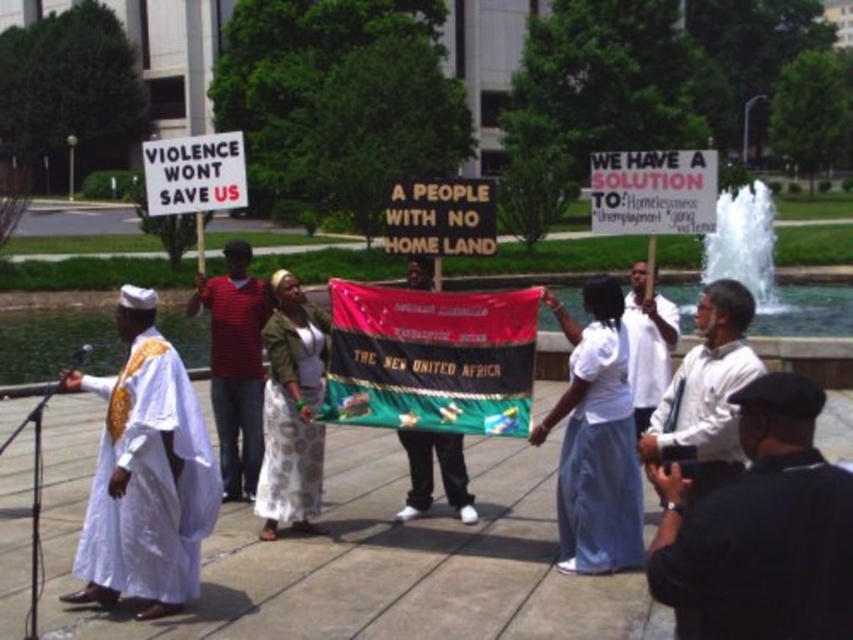
You are a photographer standing at the edge of the crowd. You want to take a photo that includes both the white stone fountain at right and the white matte robe at center. What is the minimum distance you need to move backward to ensure both objects are in frame?

The white stone fountain at right and white matte robe at center are 9.55 meters apart. To include both in your photo, you need to move back at least 9.55 meters so that the camera can capture the full distance between them.

You are standing at the speaker position and want to move to the point labeled as point (242,328). Is the point labeled as point (590,339) between you and that point?

Yes, the point labeled as point (590,339) is between the speaker and the point labeled as point (242,328) because it is closer to the speaker.

You are a photographer at the event and need to capture a photo of both the white cotton dress at center and the white satin robe at center. Which one will appear taller in the photo?

The white satin robe at center will appear taller in the photo because it has a greater height compared to the white cotton dress at center.